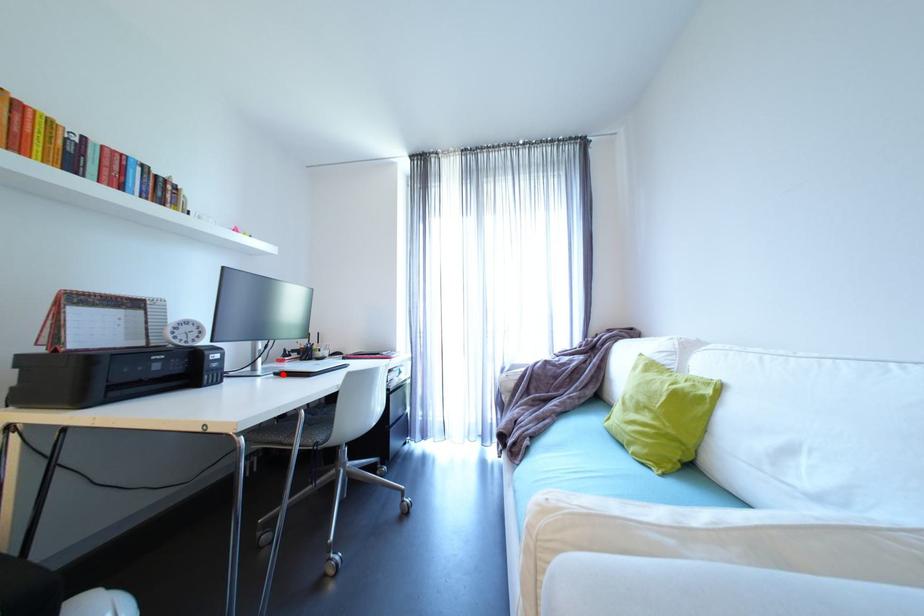
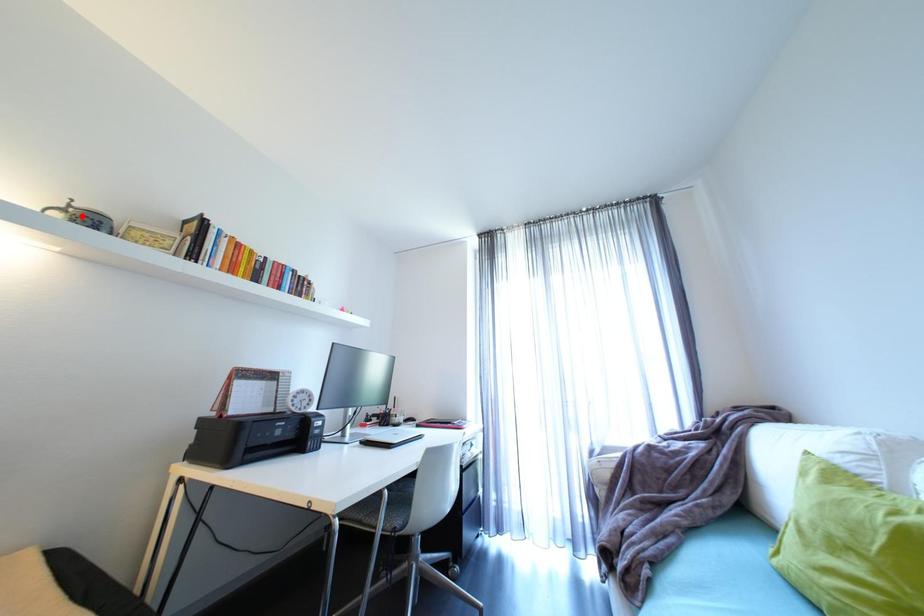
I am providing you with two images of the same scene from different viewpoints. A red point is marked on the first image and another point is marked on the second image. Is the marked point in image1 the same physical position as the marked point in image2?

No